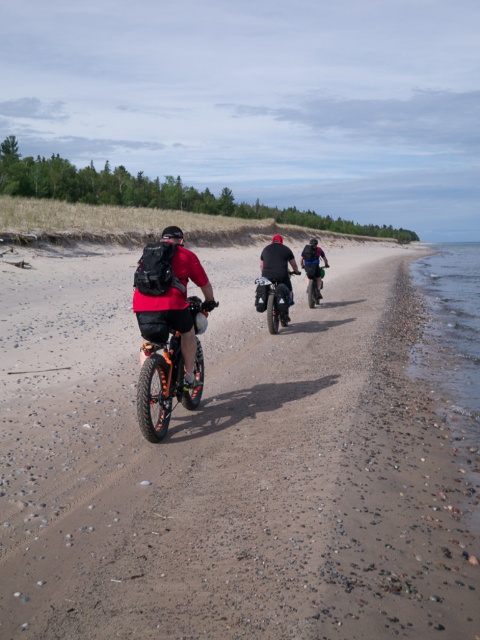
Question: Which point is farther from the camera taking this photo?

Choices:
 (A) (262, 288)
 (B) (315, 300)
 (C) (142, 388)
 (D) (264, 419)

Answer: (B)

Question: Is brown gravelly sand at center positioned before shiny black dirt bike at center?

Choices:
 (A) no
 (B) yes

Answer: (B)

Question: Is orange matte bicycle at center to the right of green matte dirt bike at center from the viewer's perspective?

Choices:
 (A) no
 (B) yes

Answer: (A)

Question: Estimate the real-world distances between objects in this image. Which object is closer to the green matte dirt bike at center?

Choices:
 (A) shiny black dirt bike at center
 (B) brown gravelly sand at center
 (C) orange matte bicycle at center

Answer: (B)

Question: Estimate the real-world distances between objects in this image. Which object is farther from the brown gravelly sand at center?

Choices:
 (A) shiny black dirt bike at center
 (B) orange matte bicycle at center
 (C) green matte dirt bike at center

Answer: (C)

Question: Is shiny black dirt bike at center further to camera compared to green matte dirt bike at center?

Choices:
 (A) yes
 (B) no

Answer: (B)